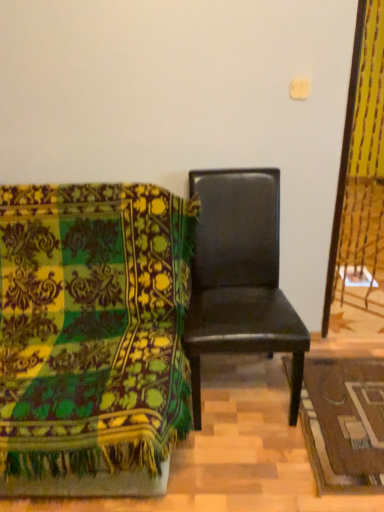
What do you see at coordinates (344, 423) in the screenshot? I see `brown woven mat at lower right` at bounding box center [344, 423].

Find the location of a particular element. Image resolution: width=384 pixels, height=512 pixels. velvet green chair at left, arranged as the first chair when viewed from the left is located at coordinates (92, 337).

From the image's perspective, between black leather chair at center, the 2th chair from the left, and velvet green chair at left, arranged as the 2th chair when viewed from the right, who is located below?

From the image's view, velvet green chair at left, arranged as the 2th chair when viewed from the right, is below.

Which point is more forward, (x=255, y=301) or (x=95, y=319)?

Point (x=95, y=319)

Would you say black leather chair at center, which is counted as the first chair, starting from the right, contains velvet green chair at left, arranged as the first chair when viewed from the left?

No, velvet green chair at left, arranged as the first chair when viewed from the left, is located outside of black leather chair at center, which is counted as the first chair, starting from the right.

Which object is further away from the camera, black leather chair at center, which is counted as the first chair, starting from the right, or velvet green chair at left, arranged as the 2th chair when viewed from the right?

black leather chair at center, which is counted as the first chair, starting from the right.

Is black leather chair at center, the 2th chair from the left, in front of or behind brown woven mat at lower right in the image?

black leather chair at center, the 2th chair from the left, is in front of brown woven mat at lower right.

Between black leather chair at center, the 2th chair from the left, and brown woven mat at lower right, which one has smaller size?

Smaller between the two is brown woven mat at lower right.

Consider the image. Does black leather chair at center, which is counted as the first chair, starting from the right, appear on the right side of brown woven mat at lower right?

Incorrect, black leather chair at center, which is counted as the first chair, starting from the right, is not on the right side of brown woven mat at lower right.

In terms of height, does black leather chair at center, the 2th chair from the left, look taller or shorter compared to brown woven mat at lower right?

In the image, black leather chair at center, the 2th chair from the left, appears to be taller than brown woven mat at lower right.

From a real-world perspective, is velvet green chair at left, arranged as the 2th chair when viewed from the right, physically located above or below black leather chair at center, which is counted as the first chair, starting from the right?

Clearly, from a real-world perspective, velvet green chair at left, arranged as the 2th chair when viewed from the right, is below black leather chair at center, which is counted as the first chair, starting from the right.

Is velvet green chair at left, arranged as the first chair when viewed from the left, looking in the opposite direction of black leather chair at center, the 2th chair from the left?

That's not correct — velvet green chair at left, arranged as the first chair when viewed from the left, is not looking away from black leather chair at center, the 2th chair from the left.

Considering the positions of points (137, 444) and (221, 227), is point (137, 444) farther from camera compared to point (221, 227)?

No, (137, 444) is in front of (221, 227).

Consider the image. Does velvet green chair at left, arranged as the first chair when viewed from the left, have a greater height compared to black leather chair at center, which is counted as the first chair, starting from the right?

No, velvet green chair at left, arranged as the first chair when viewed from the left, is not taller than black leather chair at center, which is counted as the first chair, starting from the right.

From a real-world perspective, is brown woven mat at lower right over black leather chair at center, the 2th chair from the left?

No, from a real-world perspective, brown woven mat at lower right is not over black leather chair at center, the 2th chair from the left

Is brown woven mat at lower right placed right next to black leather chair at center, which is counted as the first chair, starting from the right?

No, brown woven mat at lower right is not with black leather chair at center, which is counted as the first chair, starting from the right.

Between brown woven mat at lower right and black leather chair at center, which is counted as the first chair, starting from the right, which one has larger size?

black leather chair at center, which is counted as the first chair, starting from the right.

Identify the location of mat behind the black leather chair at center, the 2th chair from the left. (344, 423).

Does point (146, 419) lie behind point (374, 432)?

No, (146, 419) is in front of (374, 432).

From the image's perspective, is velvet green chair at left, arranged as the 2th chair when viewed from the right, located above or below brown woven mat at lower right?

Clearly, from the image's perspective, velvet green chair at left, arranged as the 2th chair when viewed from the right, is above brown woven mat at lower right.

Find the location of a particular element. chair that is the 2nd object to the left of the brown woven mat at lower right, starting at the anchor is located at coordinates (92, 337).

Which of these two, velvet green chair at left, arranged as the 2th chair when viewed from the right, or brown woven mat at lower right, is wider?

Wider between the two is velvet green chair at left, arranged as the 2th chair when viewed from the right.

Does brown woven mat at lower right have a greater height compared to velvet green chair at left, arranged as the first chair when viewed from the left?

In fact, brown woven mat at lower right may be shorter than velvet green chair at left, arranged as the first chair when viewed from the left.

Considering the sizes of brown woven mat at lower right and velvet green chair at left, arranged as the first chair when viewed from the left, in the image, is brown woven mat at lower right wider or thinner than velvet green chair at left, arranged as the first chair when viewed from the left,?

Considering their sizes, brown woven mat at lower right looks slimmer than velvet green chair at left, arranged as the first chair when viewed from the left.

Does point (316, 425) lie behind point (111, 478)?

Yes, point (316, 425) is farther from viewer.

From a real-world perspective, is brown woven mat at lower right above or below velvet green chair at left, arranged as the 2th chair when viewed from the right?

In terms of real-world spatial position, brown woven mat at lower right is below velvet green chair at left, arranged as the 2th chair when viewed from the right.

The image size is (384, 512). I want to click on chair on the right of velvet green chair at left, arranged as the 2th chair when viewed from the right, so click(240, 277).

The image size is (384, 512). What are the coordinates of `mat located below the black leather chair at center, the 2th chair from the left (from the image's perspective)` in the screenshot? It's located at (344, 423).

Considering their positions, is brown woven mat at lower right positioned further to black leather chair at center, the 2th chair from the left, than velvet green chair at left, arranged as the 2th chair when viewed from the right?

brown woven mat at lower right.

When comparing their distances from black leather chair at center, the 2th chair from the left, does velvet green chair at left, arranged as the first chair when viewed from the left, or brown woven mat at lower right seem closer?

Among the two, velvet green chair at left, arranged as the first chair when viewed from the left, is located nearer to black leather chair at center, the 2th chair from the left.

Based on their spatial positions, is black leather chair at center, the 2th chair from the left, or velvet green chair at left, arranged as the 2th chair when viewed from the right, closer to brown woven mat at lower right?

Among the two, black leather chair at center, the 2th chair from the left, is located nearer to brown woven mat at lower right.

Looking at this image, from the image, which object appears to be farther from brown woven mat at lower right, velvet green chair at left, arranged as the 2th chair when viewed from the right, or black leather chair at center, the 2th chair from the left?

Among the two, velvet green chair at left, arranged as the 2th chair when viewed from the right, is located further to brown woven mat at lower right.

Estimate the real-world distances between objects in this image. Which object is further from velvet green chair at left, arranged as the 2th chair when viewed from the right, brown woven mat at lower right or black leather chair at center, which is counted as the first chair, starting from the right?

Based on the image, brown woven mat at lower right appears to be further to velvet green chair at left, arranged as the 2th chair when viewed from the right.

Which object lies nearer to the anchor point velvet green chair at left, arranged as the first chair when viewed from the left, black leather chair at center, which is counted as the first chair, starting from the right, or brown woven mat at lower right?

Based on the image, black leather chair at center, which is counted as the first chair, starting from the right, appears to be nearer to velvet green chair at left, arranged as the first chair when viewed from the left.

You are a GUI agent. You are given a task and a screenshot of the screen. Output one action in this format:
    pyautogui.click(x=<x>, y=<y>)
    Task: Click on the chair between velvet green chair at left, arranged as the first chair when viewed from the left, and brown woven mat at lower right
    The width and height of the screenshot is (384, 512).
    Given the screenshot: What is the action you would take?
    pyautogui.click(x=240, y=277)